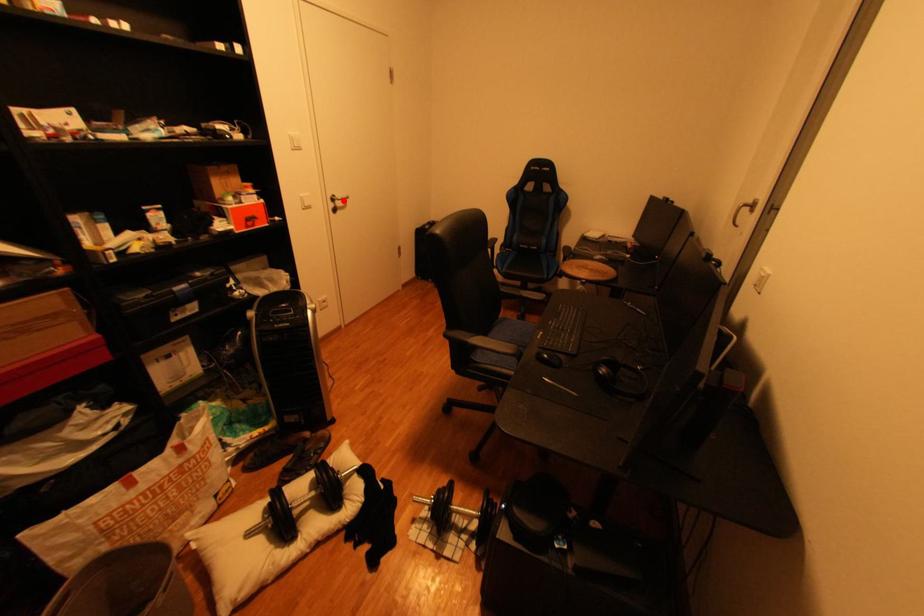
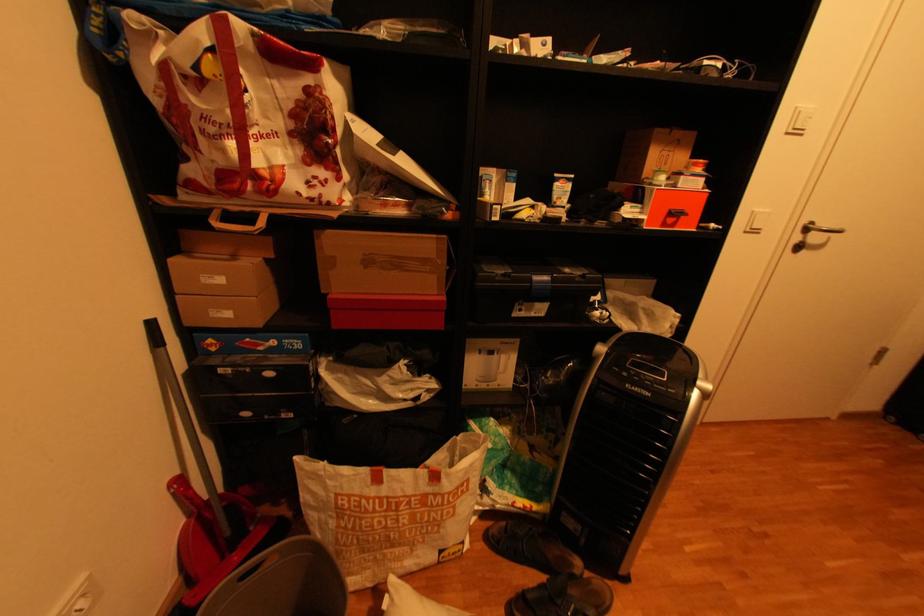
The point at the highlighted location is marked in the first image. Where is the corresponding point in the second image?

(816, 230)